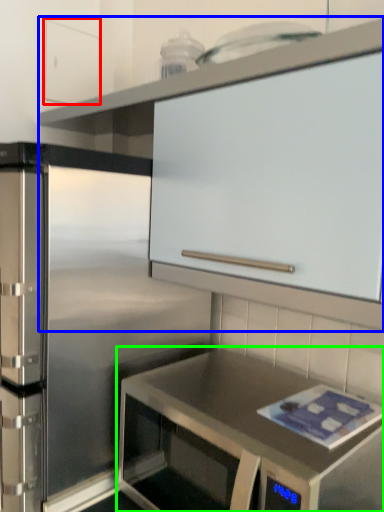
Question: Based on their relative distances, which object is farther from cabinetry (highlighted by a red box)? Choose from cabinetry (highlighted by a blue box) and countertop (highlighted by a green box).

Choices:
 (A) cabinetry
 (B) countertop

Answer: (B)